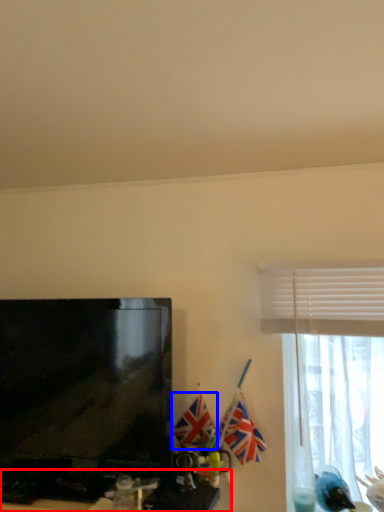
Question: Among these objects, which one is farthest to the camera, computer desk (highlighted by a red box) or flag (highlighted by a blue box)?

Choices:
 (A) computer desk
 (B) flag

Answer: (B)